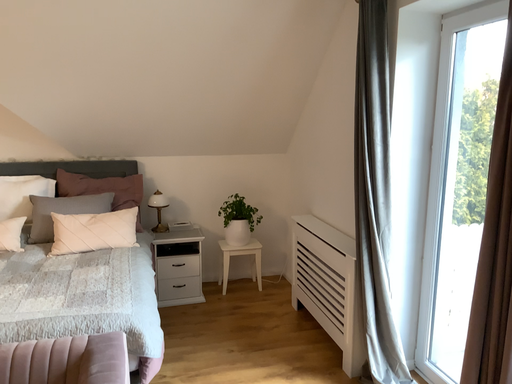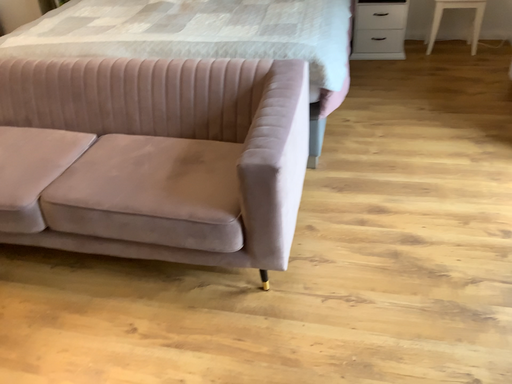
Question: Which way did the camera rotate in the video?

Choices:
 (A) rotated left
 (B) rotated right

Answer: (A)